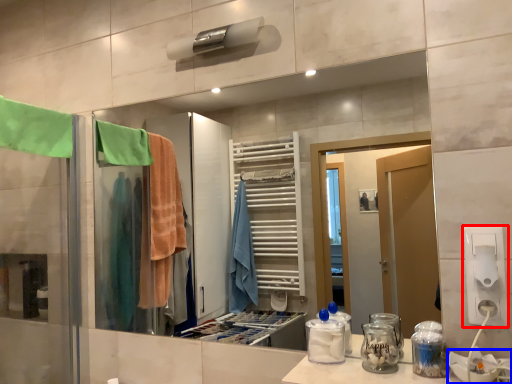
Question: Among these objects, which one is nearest to the camera, electric outlet (highlighted by a red box) or sink (highlighted by a blue box)?

Choices:
 (A) electric outlet
 (B) sink

Answer: (B)